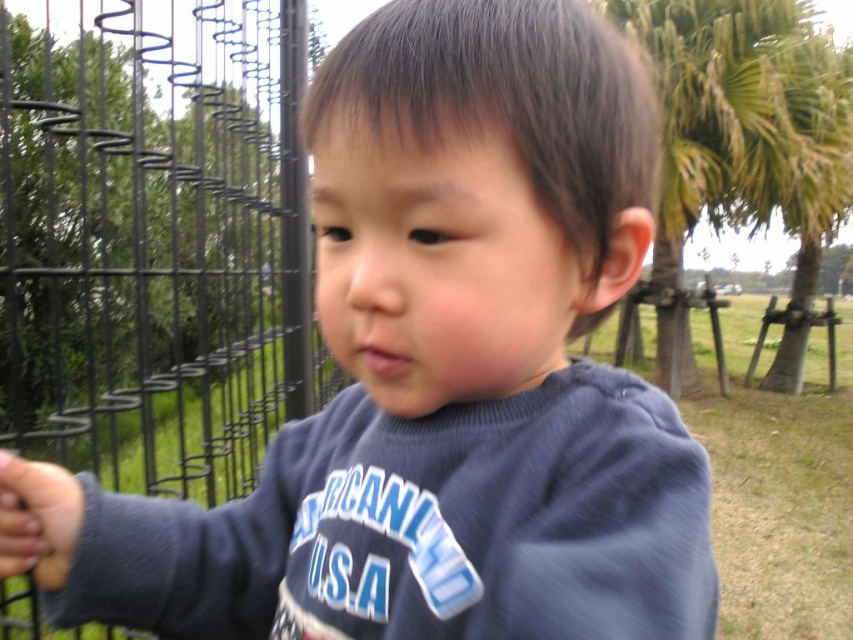
Does point (16, 76) come closer to viewer compared to point (664, 138)?

Yes.

Is black wire fence at left above green leafy palm tree at upper right?

Actually, black wire fence at left is below green leafy palm tree at upper right.

Between point (200, 168) and point (712, 10), which one is positioned behind?

Positioned behind is point (712, 10).

This screenshot has height=640, width=853. I want to click on black wire fence at left, so click(x=155, y=240).